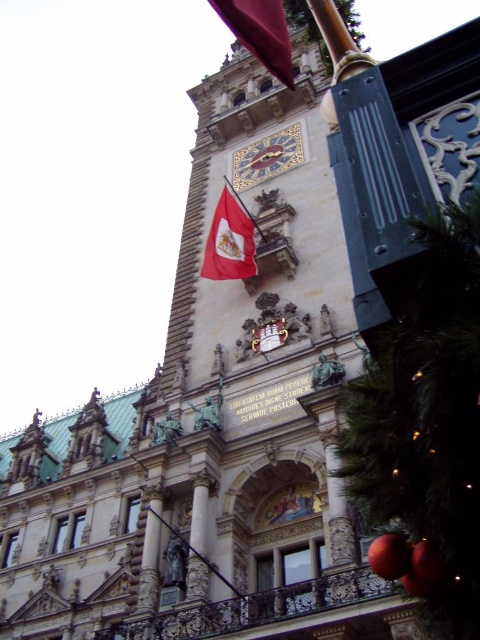
Question: Which point appears closest to the camera in this image?

Choices:
 (A) (238, 278)
 (B) (292, 161)
 (C) (244, 10)

Answer: (C)

Question: Estimate the real-world distances between objects in this image. Which object is farther from the red fabric flag at center?

Choices:
 (A) matte red flag at upper center
 (B) gold mosaic clock at center

Answer: (A)

Question: Is matte red flag at upper center to the left of gold mosaic clock at center from the viewer's perspective?

Choices:
 (A) no
 (B) yes

Answer: (B)

Question: Can you confirm if red fabric flag at center is wider than gold mosaic clock at center?

Choices:
 (A) no
 (B) yes

Answer: (A)

Question: Is matte red flag at upper center bigger than red fabric flag at center?

Choices:
 (A) yes
 (B) no

Answer: (A)

Question: Estimate the real-world distances between objects in this image. Which object is farther from the red fabric flag at center?

Choices:
 (A) matte red flag at upper center
 (B) gold mosaic clock at center

Answer: (A)